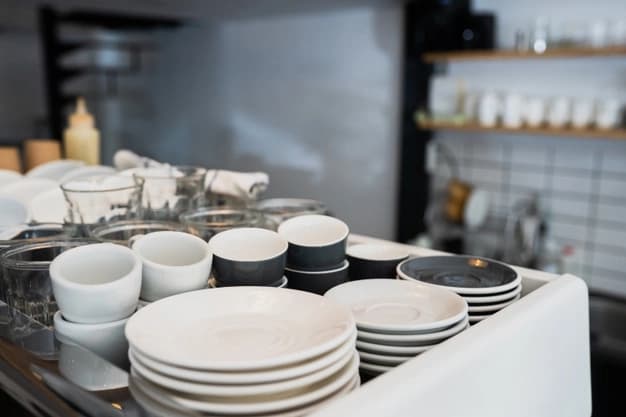
This screenshot has height=417, width=626. In order to click on ramekin in this screenshot , I will do [259, 251], [283, 281], [304, 283], [314, 253].